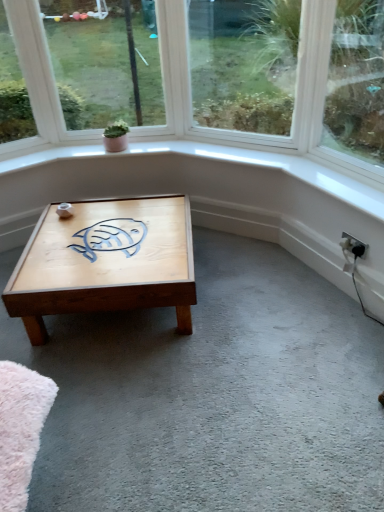
What is the approximate width of green matte plant at upper center?

green matte plant at upper center is 5.55 inches wide.

Locate an element on the screen. Image resolution: width=384 pixels, height=512 pixels. clear glass window at upper left, which ranks as the first window in left-to-right order is located at coordinates (88, 71).

Identify the location of white plastic electric outlet at lower right. The image size is (384, 512). (354, 245).

Which object is closer to the camera, light brown wooden coffee table at center or clear glass window at upper left, which ranks as the first window in left-to-right order?

light brown wooden coffee table at center.

Considering the positions of points (58, 301) and (46, 131), is point (58, 301) closer to camera compared to point (46, 131)?

Yes, it is in front of point (46, 131).

Identify the location of coffee table below the clear glass window at upper left, which ranks as the first window in left-to-right order (from the image's perspective). The width and height of the screenshot is (384, 512). (106, 262).

Who is smaller, clear glass window at upper left, which ranks as the first window in left-to-right order, or green matte plant at upper center?

green matte plant at upper center.

From the image's perspective, is clear glass window at upper left, which is the second window from right to left, on top of green matte plant at upper center?

Indeed, from the image's perspective, clear glass window at upper left, which is the second window from right to left, is shown above green matte plant at upper center.

Which of these two, clear glass window at upper left, which ranks as the first window in left-to-right order, or green matte plant at upper center, stands shorter?

Standing shorter between the two is green matte plant at upper center.

The width and height of the screenshot is (384, 512). What are the coordinates of `houseplant below the clear glass window at upper left, which ranks as the first window in left-to-right order (from a real-world perspective)` in the screenshot? It's located at (116, 136).

Considering the points (346, 241) and (290, 34), which point is in front, point (346, 241) or point (290, 34)?

The point (346, 241) is closer.

Where is `electric outlet that appears on the right of clear glass window at center, the first window from the right`? This screenshot has width=384, height=512. electric outlet that appears on the right of clear glass window at center, the first window from the right is located at coordinates (354, 245).

Does white plastic electric outlet at lower right appear on the right side of clear glass window at center, the first window from the right?

Indeed, white plastic electric outlet at lower right is positioned on the right side of clear glass window at center, the first window from the right.

Would you say white plastic electric outlet at lower right is a long distance from green matte plant at upper center?

Yes.

Considering the relative sizes of white plastic electric outlet at lower right and green matte plant at upper center in the image provided, is white plastic electric outlet at lower right bigger than green matte plant at upper center?

No.

From the image's perspective, which object appears higher, white plastic electric outlet at lower right or green matte plant at upper center?

green matte plant at upper center appears higher in the image.

Which is less distant, [59,138] or [285,66]?

Clearly, point [59,138] is closer to the camera than point [285,66].

From the image's perspective, which object appears higher, clear glass window at upper left, which is the second window from right to left, or clear glass window at center, positioned as the second window in left-to-right order?

clear glass window at upper left, which is the second window from right to left, appears higher in the image.

Is clear glass window at upper left, which is the second window from right to left, facing towards clear glass window at center, positioned as the second window in left-to-right order?

No.

From a real-world perspective, relative to clear glass window at center, positioned as the second window in left-to-right order, is clear glass window at upper left, which ranks as the first window in left-to-right order, vertically above or below?

From a real-world perspective, clear glass window at upper left, which ranks as the first window in left-to-right order, is physically above clear glass window at center, positioned as the second window in left-to-right order.

Where is `electric outlet located in front of the clear glass window at upper left, which ranks as the first window in left-to-right order`? electric outlet located in front of the clear glass window at upper left, which ranks as the first window in left-to-right order is located at coordinates (354, 245).

In terms of size, does white plastic electric outlet at lower right appear bigger or smaller than clear glass window at upper left, which ranks as the first window in left-to-right order?

In the image, white plastic electric outlet at lower right appears to be smaller than clear glass window at upper left, which ranks as the first window in left-to-right order.

Considering the sizes of white plastic electric outlet at lower right and clear glass window at upper left, which is the second window from right to left, in the image, is white plastic electric outlet at lower right taller or shorter than clear glass window at upper left, which is the second window from right to left,?

Considering their sizes, white plastic electric outlet at lower right has less height than clear glass window at upper left, which is the second window from right to left.

Does white plastic electric outlet at lower right have a greater width compared to clear glass window at upper left, which ranks as the first window in left-to-right order?

Incorrect, the width of white plastic electric outlet at lower right does not surpass that of clear glass window at upper left, which ranks as the first window in left-to-right order.

From a real-world perspective, between clear glass window at upper left, which ranks as the first window in left-to-right order, and white plastic electric outlet at lower right, who is vertically lower?

white plastic electric outlet at lower right.

From the image's perspective, is clear glass window at upper left, which ranks as the first window in left-to-right order, above or below white plastic electric outlet at lower right?

Clearly, from the image's perspective, clear glass window at upper left, which ranks as the first window in left-to-right order, is above white plastic electric outlet at lower right.

This screenshot has width=384, height=512. What are the coordinates of `the 2nd window to the left of the white plastic electric outlet at lower right, counting from the anchor's position` in the screenshot? It's located at (88, 71).

Which is in front, clear glass window at upper left, which is the second window from right to left, or white plastic electric outlet at lower right?

Positioned in front is white plastic electric outlet at lower right.

This screenshot has height=512, width=384. Find the location of `window on the left of light brown wooden coffee table at center`. window on the left of light brown wooden coffee table at center is located at coordinates (88, 71).

You are a GUI agent. You are given a task and a screenshot of the screen. Output one action in this format:
    pyautogui.click(x=<x>, y=<y>)
    Task: Click on the 2nd window above the green matte plant at upper center (from a real-world perspective)
    Image resolution: width=384 pixels, height=512 pixels.
    Given the screenshot: What is the action you would take?
    88,71

Which object lies nearer to the anchor point clear glass window at upper left, which ranks as the first window in left-to-right order, clear glass window at center, the first window from the right, or white plastic electric outlet at lower right?

clear glass window at center, the first window from the right.

Considering their positions, is light brown wooden coffee table at center positioned further to white plastic electric outlet at lower right than clear glass window at upper left, which is the second window from right to left?

clear glass window at upper left, which is the second window from right to left, lies further to white plastic electric outlet at lower right than the other object.

When comparing their distances from clear glass window at center, positioned as the second window in left-to-right order, does white plastic electric outlet at lower right or clear glass window at upper left, which is the second window from right to left, seem further?

white plastic electric outlet at lower right is positioned further to the anchor clear glass window at center, positioned as the second window in left-to-right order.

Based on their spatial positions, is light brown wooden coffee table at center or green matte plant at upper center closer to white plastic electric outlet at lower right?

The object closer to white plastic electric outlet at lower right is light brown wooden coffee table at center.

Looking at the image, which one is located further to clear glass window at upper left, which ranks as the first window in left-to-right order, clear glass window at center, the first window from the right, or green matte plant at upper center?

The object further to clear glass window at upper left, which ranks as the first window in left-to-right order, is clear glass window at center, the first window from the right.

When comparing their distances from white plastic electric outlet at lower right, does clear glass window at upper left, which ranks as the first window in left-to-right order, or green matte plant at upper center seem further?

clear glass window at upper left, which ranks as the first window in left-to-right order, lies further to white plastic electric outlet at lower right than the other object.

Looking at the image, which one is located closer to clear glass window at upper left, which is the second window from right to left, light brown wooden coffee table at center or green matte plant at upper center?

The object closer to clear glass window at upper left, which is the second window from right to left, is green matte plant at upper center.

Considering their positions, is light brown wooden coffee table at center positioned further to white plastic electric outlet at lower right than clear glass window at center, the first window from the right?

clear glass window at center, the first window from the right, lies further to white plastic electric outlet at lower right than the other object.

Locate an element on the screen. coffee table situated between clear glass window at upper left, which is the second window from right to left, and white plastic electric outlet at lower right from left to right is located at coordinates (106, 262).

Where is `houseplant situated between clear glass window at upper left, which ranks as the first window in left-to-right order, and clear glass window at center, the first window from the right, from left to right`? The width and height of the screenshot is (384, 512). houseplant situated between clear glass window at upper left, which ranks as the first window in left-to-right order, and clear glass window at center, the first window from the right, from left to right is located at coordinates (116, 136).

This screenshot has width=384, height=512. I want to click on houseplant between clear glass window at upper left, which ranks as the first window in left-to-right order, and light brown wooden coffee table at center vertically, so (116, 136).

In order to click on window between clear glass window at upper left, which ranks as the first window in left-to-right order, and light brown wooden coffee table at center from top to bottom in this screenshot , I will do point(244,64).